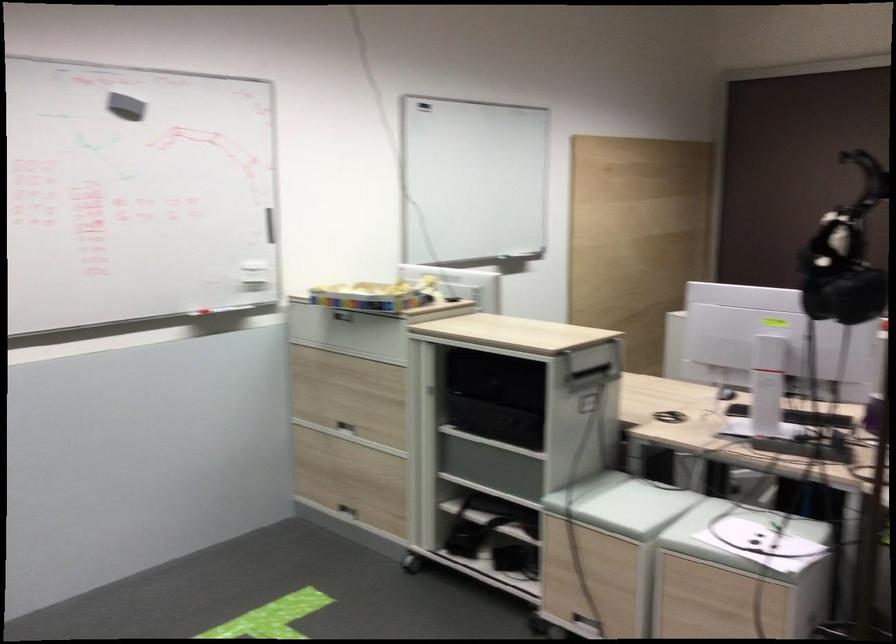
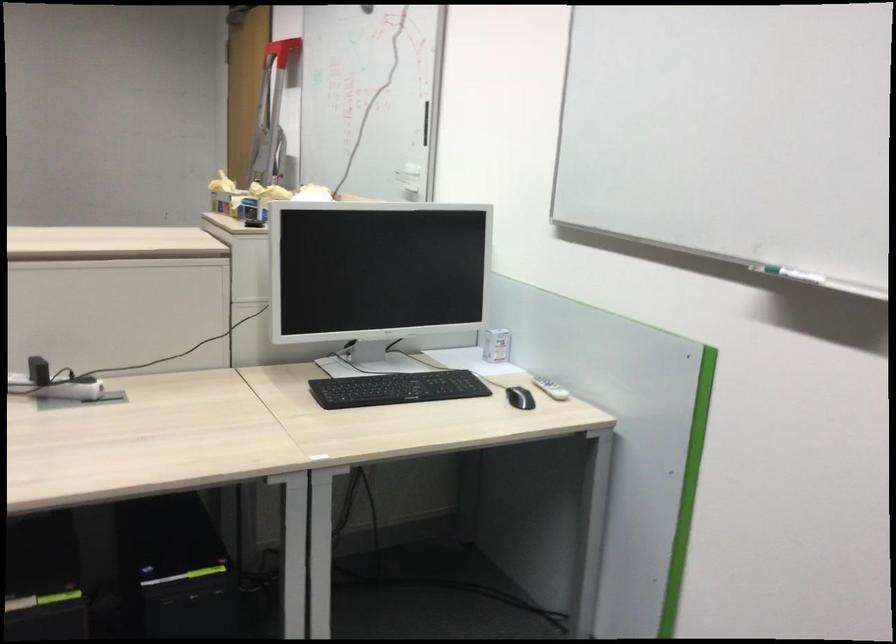
Find the pixel in the second image that matches pixel 500 249 in the first image.

(794, 275)